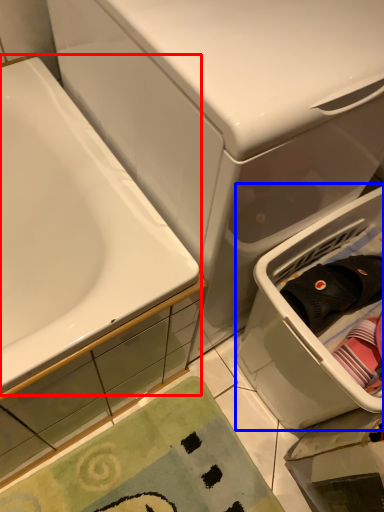
Question: Among these objects, which one is nearest to the camera, bathtub (highlighted by a red box) or laundry basket (highlighted by a blue box)?

Choices:
 (A) bathtub
 (B) laundry basket

Answer: (A)